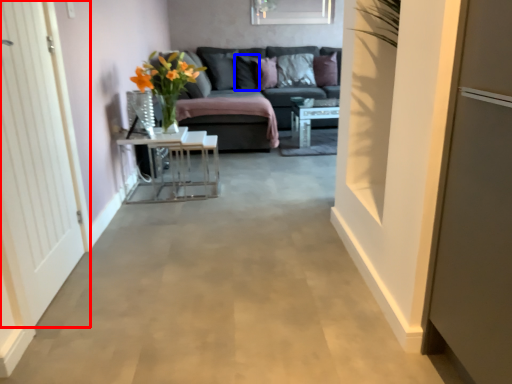
Question: Which object is further to the camera taking this photo, door (highlighted by a red box) or pillow (highlighted by a blue box)?

Choices:
 (A) door
 (B) pillow

Answer: (B)